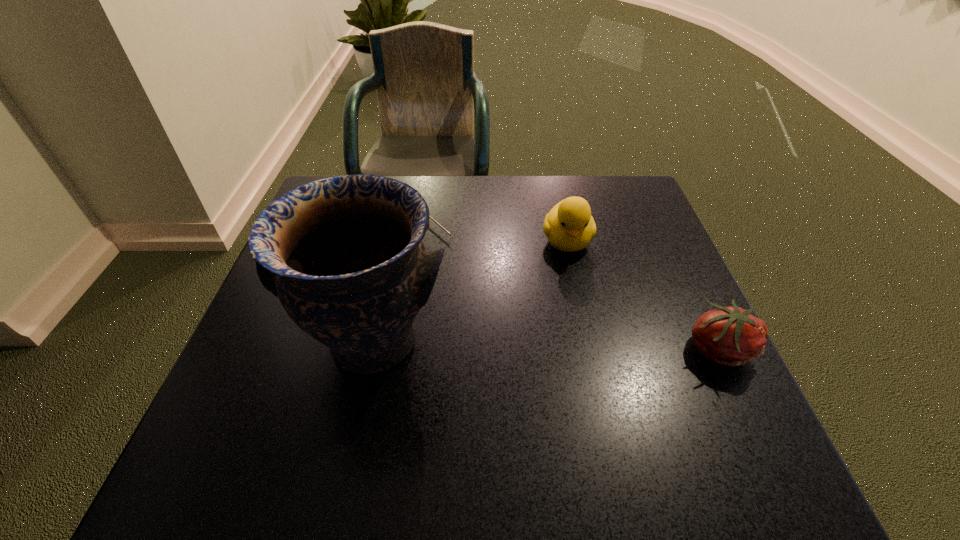
Identify the location of the closest object to the screwdriver. (344, 255).

Choose which object is the nearest neighbor to the third tallest object. Please provide its 2D coordinates. Your answer should be formatted as a tuple, i.e. [(x, y)], where the tuple contains the x and y coordinates of a point satisfying the conditions above.

[(569, 226)]

You are a GUI agent. You are given a task and a screenshot of the screen. Output one action in this format:
    pyautogui.click(x=<x>, y=<y>)
    Task: Click on the vacant space that satisfies the following two spatial constraints: 1. on the front side of the second shortest object; 2. on the front-facing side of the duck
    Image resolution: width=960 pixels, height=540 pixels.
    Given the screenshot: What is the action you would take?
    pyautogui.click(x=590, y=348)

At what (x,y) coordinates should I click in order to perform the action: click on free spot that satisfies the following two spatial constraints: 1. on the front handle of the pottery; 2. on the front-facing side of the rightmost object. Please return your answer as a coordinate pair (x, y). The height and width of the screenshot is (540, 960). Looking at the image, I should click on (372, 348).

What are the coordinates of `vacant area that satisfies the following two spatial constraints: 1. on the front handle of the rightmost object; 2. on the front-facing side of the pottery` in the screenshot? It's located at (372, 348).

I want to click on free space in the image that satisfies the following two spatial constraints: 1. on the front handle of the tallest object; 2. on the front-facing side of the tomato, so click(x=372, y=348).

Where is `vacant point that satisfies the following two spatial constraints: 1. on the front handle of the tallest object; 2. on the front-facing side of the third tallest object`? The width and height of the screenshot is (960, 540). vacant point that satisfies the following two spatial constraints: 1. on the front handle of the tallest object; 2. on the front-facing side of the third tallest object is located at coordinates (372, 348).

At what (x,y) coordinates should I click in order to perform the action: click on free spot that satisfies the following two spatial constraints: 1. on the front side of the tomato; 2. on the front-facing side of the second object from right to left. Please return your answer as a coordinate pair (x, y). This screenshot has height=540, width=960. Looking at the image, I should click on (590, 348).